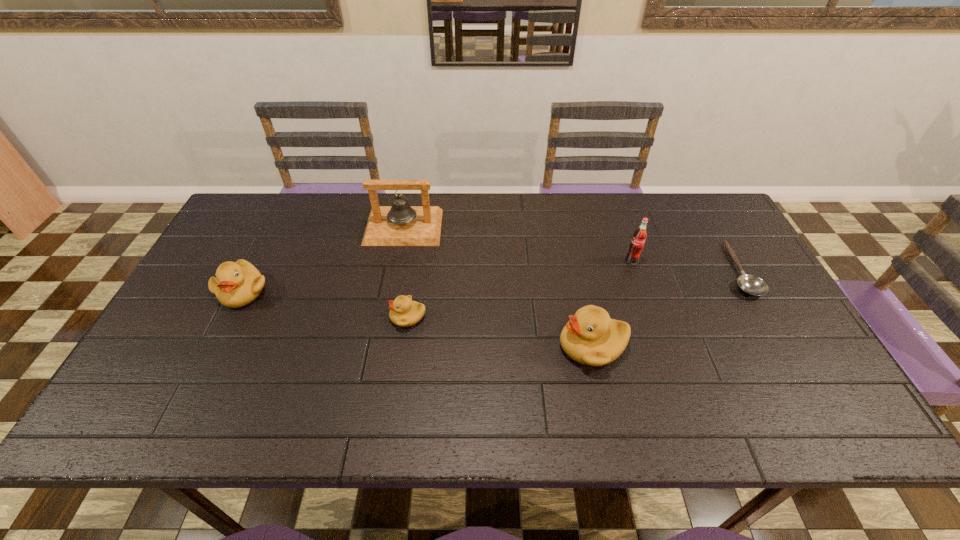
Please show where to add a duckling on the right while keeping spacing even. Please provide its 2D coordinates. Your answer should be formatted as a tuple, i.e. [(x, y)], where the tuple contains the x and y coordinates of a point satisfying the conditions above.

[(799, 377)]